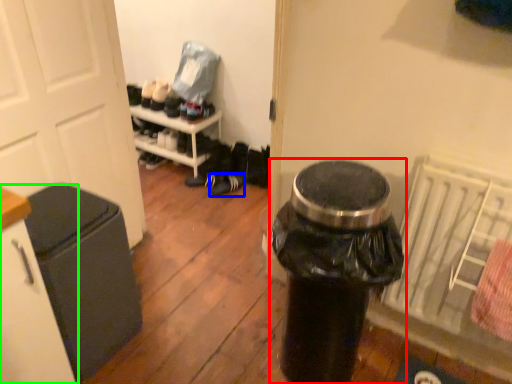
Question: Based on their relative distances, which object is farther from waste container (highlighted by a red box)? Choose from footwear (highlighted by a blue box) and cabinetry (highlighted by a green box).

Choices:
 (A) footwear
 (B) cabinetry

Answer: (A)